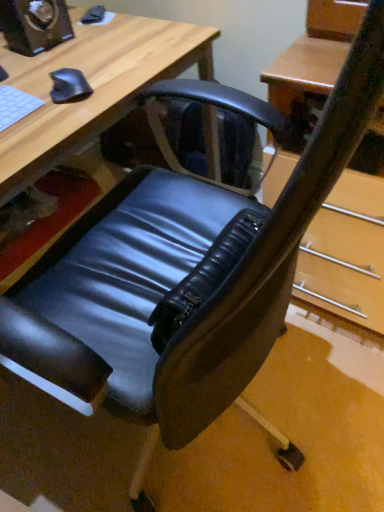
The height and width of the screenshot is (512, 384). In order to click on free spot to the right of white matte keyboard at upper left in this screenshot , I will do [x=51, y=121].